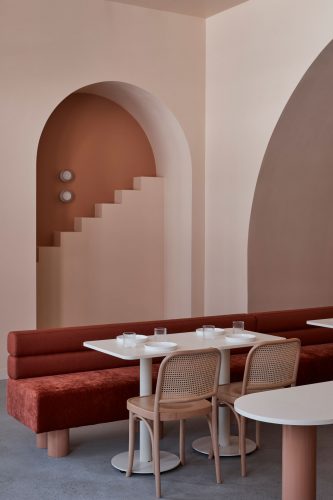
Locate an element on the screen. glass is located at coordinates (240, 324).